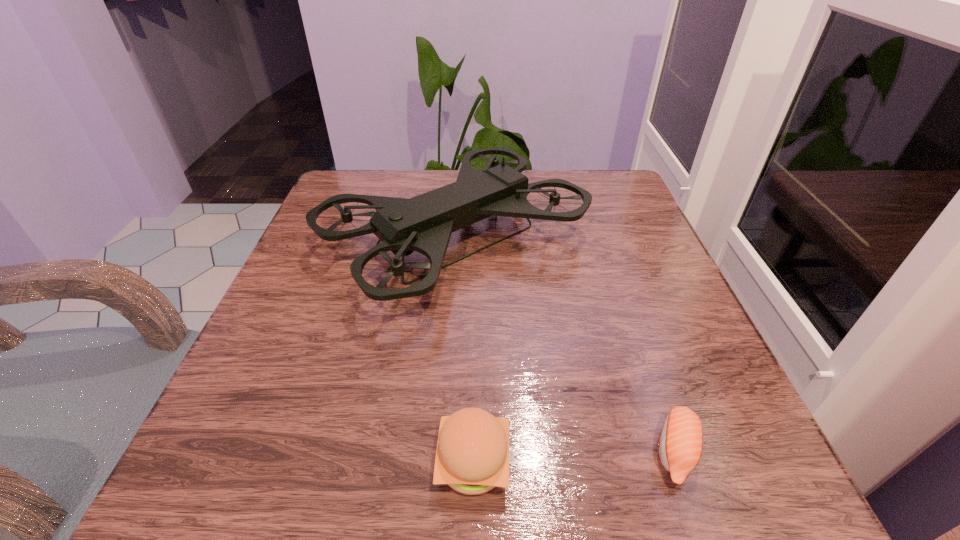
Identify the location of drone. This screenshot has height=540, width=960. (424, 223).

Where is `the tallest object`? This screenshot has width=960, height=540. the tallest object is located at coordinates (424, 223).

At what (x,y) coordinates should I click in order to perform the action: click on hamburger. Please return your answer as a coordinate pair (x, y). The image size is (960, 540). Looking at the image, I should click on (472, 456).

Locate an element on the screen. This screenshot has height=540, width=960. sushi is located at coordinates (680, 446).

This screenshot has height=540, width=960. I want to click on vacant area located on the front of the tallest object, so [441, 431].

In order to click on vacant region located 0.330m on the right of the second tallest object in this screenshot , I will do point(762,462).

This screenshot has width=960, height=540. Find the location of `vacant space located on the left of the shortest object`. vacant space located on the left of the shortest object is located at coordinates (428, 451).

Identify the location of object that is at the far edge. (424, 223).

The height and width of the screenshot is (540, 960). Identify the location of hamburger located at the near edge. (472, 456).

Where is `sushi that is at the near edge`? sushi that is at the near edge is located at coordinates (680, 446).